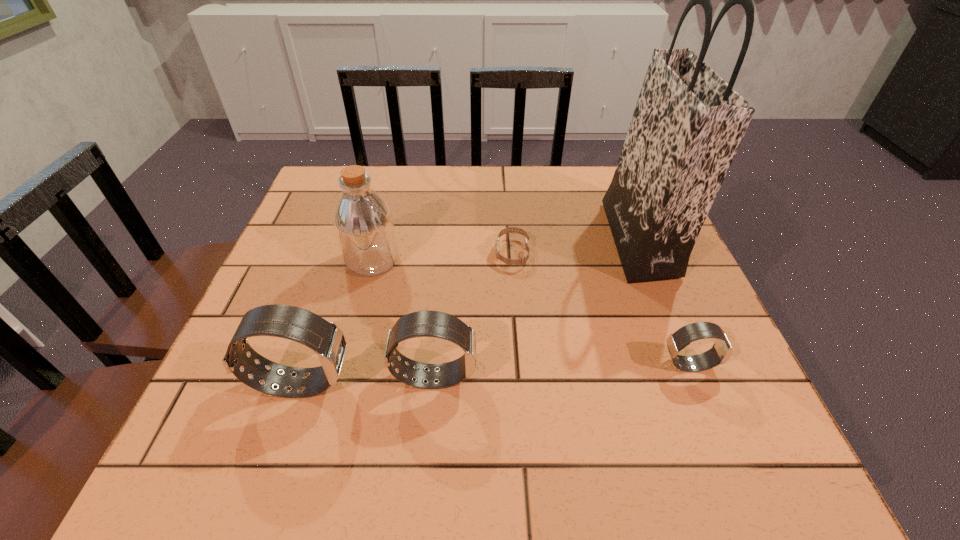
Image resolution: width=960 pixels, height=540 pixels. Identify the location of empty space between the tallest object and the second watch from left to right. (537, 307).

Identify the location of free area in between the second tallest object and the shopping bag. (505, 249).

Locate an element on the screen. The image size is (960, 540). blank region between the leftmost watch and the fifth tallest object is located at coordinates (495, 373).

You are a GUI agent. You are given a task and a screenshot of the screen. Output one action in this format:
    pyautogui.click(x=<x>, y=<y>)
    Task: Click on the unoccupied position between the fifth tallest object and the shopping bag
    This screenshot has height=540, width=960.
    Given the screenshot: What is the action you would take?
    pyautogui.click(x=663, y=301)

Locate an element on the screen. The width and height of the screenshot is (960, 540). free spot between the rightmost watch and the second tallest object is located at coordinates (531, 312).

Where is `empty space between the leftmost watch and the shopping bag`? The width and height of the screenshot is (960, 540). empty space between the leftmost watch and the shopping bag is located at coordinates (470, 310).

You are a GUI agent. You are given a task and a screenshot of the screen. Output one action in this format:
    pyautogui.click(x=<x>, y=<y>)
    Task: Click on the vacant space in between the fourth object from left to right and the third object from left to right
    The image size is (960, 540).
    Given the screenshot: What is the action you would take?
    pyautogui.click(x=473, y=315)

At what (x,y) coordinates should I click in order to perform the action: click on free spot between the leftmost watch and the tallest object. Please return your answer as a coordinate pair (x, y). This screenshot has width=960, height=540. Looking at the image, I should click on (470, 310).

Find the location of a particular element. free area in between the second watch from left to right and the fifth tallest object is located at coordinates pos(562,370).

Identify which object is the fourth closest to the bottle. Please provide its 2D coordinates. Your answer should be formatted as a tuple, i.e. [(x, y)], where the tuple contains the x and y coordinates of a point satisfying the conditions above.

[(688, 123)]